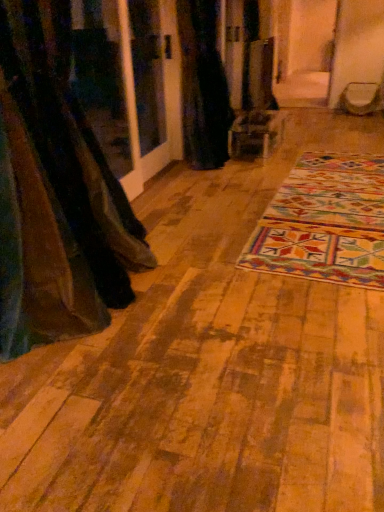
Where is `vacant space to the right of brown fabric curtain at left, which appears as the second curtain when viewed from the right`? The width and height of the screenshot is (384, 512). vacant space to the right of brown fabric curtain at left, which appears as the second curtain when viewed from the right is located at coordinates (177, 325).